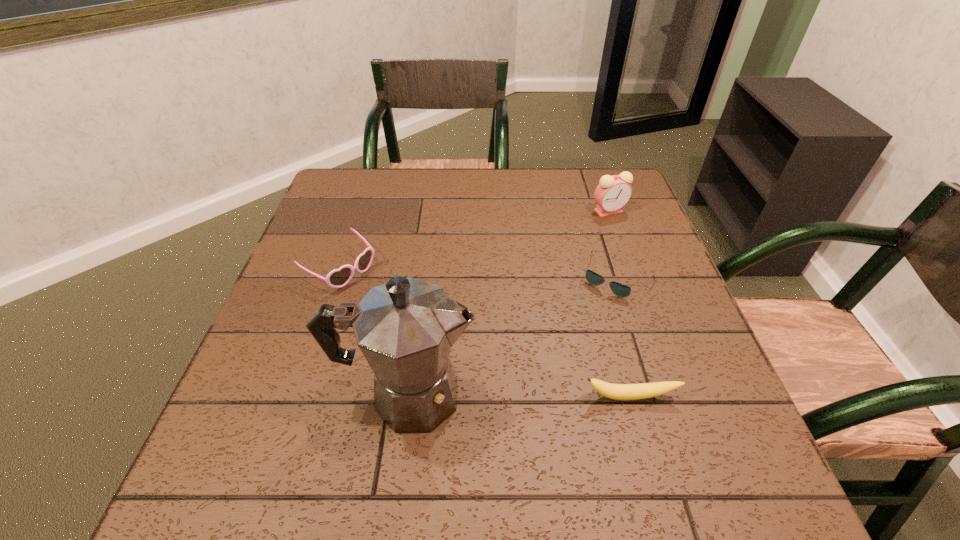
Identify the location of vacant space at the right edge of the desktop. (641, 280).

This screenshot has height=540, width=960. Find the location of `free region at the near left corner of the desktop`. free region at the near left corner of the desktop is located at coordinates (254, 417).

In the image, there is a desktop. Where is `free space at the far right corner`? free space at the far right corner is located at coordinates point(625,170).

At what (x,y) coordinates should I click in order to perform the action: click on free space between the farthest object and the banana. Please return your answer as a coordinate pair (x, y). This screenshot has height=540, width=960. Looking at the image, I should click on (619, 304).

Locate an element on the screen. The image size is (960, 540). vacant space that is in between the tallest object and the shorter sunglasses is located at coordinates (512, 336).

I want to click on free spot between the second tallest object and the coffeepot, so click(508, 303).

The height and width of the screenshot is (540, 960). Find the location of `empty space that is in between the shorter sunglasses and the tallest object`. empty space that is in between the shorter sunglasses and the tallest object is located at coordinates (512, 336).

This screenshot has width=960, height=540. I want to click on free space between the farthest object and the tallest object, so click(x=508, y=303).

The width and height of the screenshot is (960, 540). Find the location of `unoccupied position between the tallest object and the alarm clock`. unoccupied position between the tallest object and the alarm clock is located at coordinates (508, 303).

You are a GUI agent. You are given a task and a screenshot of the screen. Output one action in this format:
    pyautogui.click(x=<x>, y=<y>)
    Task: Click on the free space between the alarm clock and the coffeepot
    
    Given the screenshot: What is the action you would take?
    pyautogui.click(x=508, y=303)